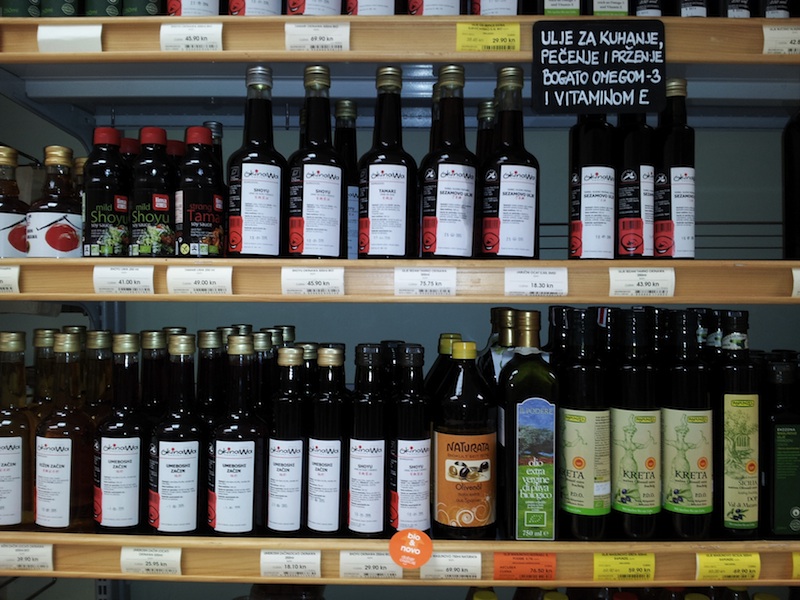
Find the location of a particular element. The height and width of the screenshot is (600, 800). metal shelving is located at coordinates click(129, 81), click(218, 92), click(754, 88).